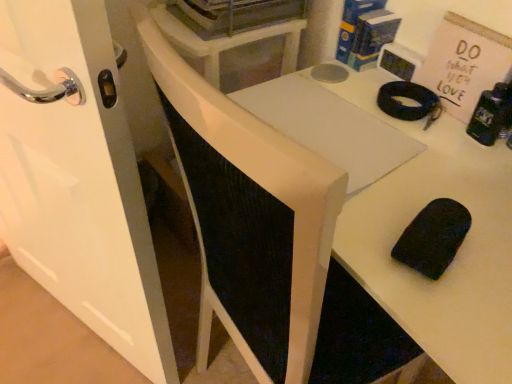
Locate an element on the screen. This screenshot has height=384, width=512. vacant space underneath white glossy door at left (from a real-world perspective) is located at coordinates (77, 325).